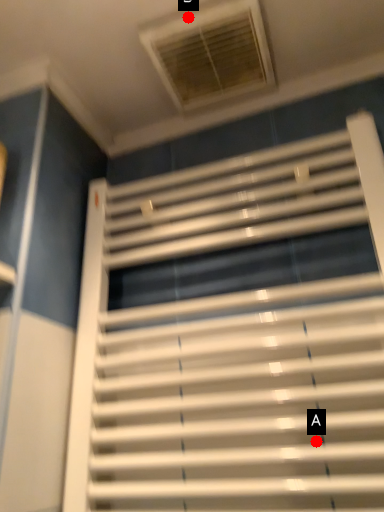
Question: Two points are circled on the image, labeled by A and B beside each circle. Which point is farther from the camera taking this photo?

Choices:
 (A) A is further
 (B) B is further

Answer: (B)